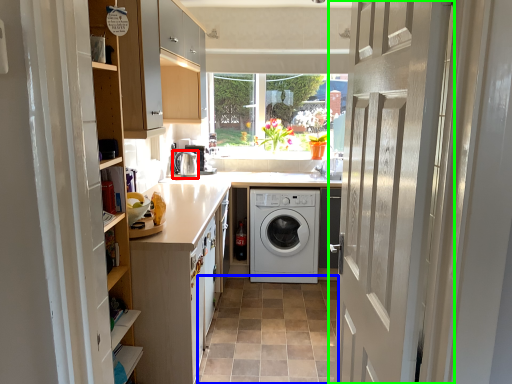
Question: Considering the real-world distances, which object is closest to water heater (highlighted by a red box)? plain (highlighted by a blue box) or door (highlighted by a green box).

Choices:
 (A) plain
 (B) door

Answer: (A)